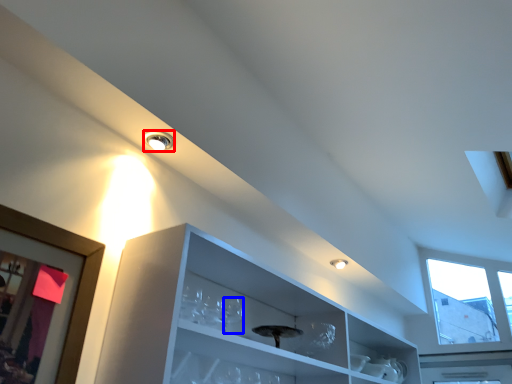
Question: Which object is closer to the camera taking this photo, droplight (highlighted by a red box) or wine glass (highlighted by a blue box)?

Choices:
 (A) droplight
 (B) wine glass

Answer: (B)